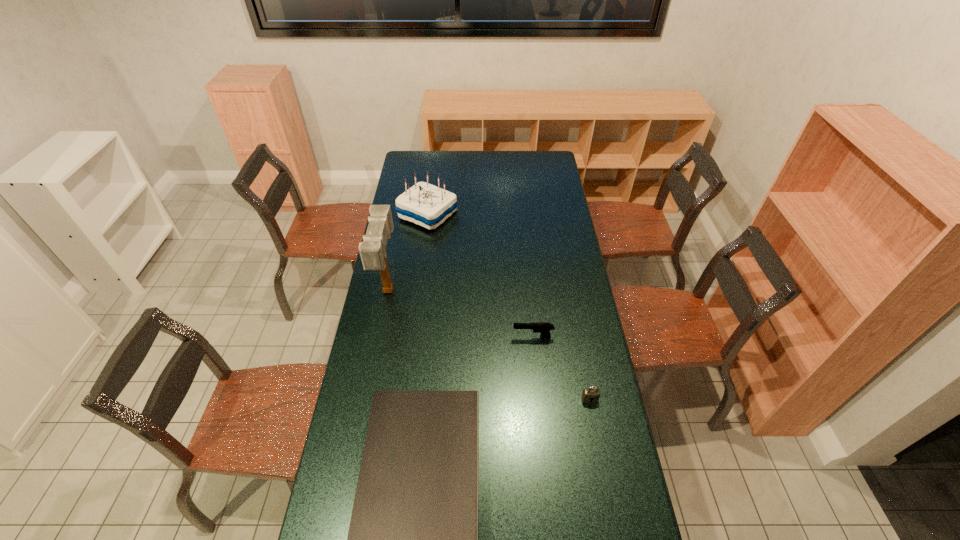
You are a GUI agent. You are given a task and a screenshot of the screen. Output one action in this format:
    pyautogui.click(x=<x>, y=<y>)
    Task: Click on the free space at the far left corner of the desktop
    The width and height of the screenshot is (960, 540).
    Given the screenshot: What is the action you would take?
    pyautogui.click(x=421, y=170)

Image resolution: width=960 pixels, height=540 pixels. I want to click on vacant space at the far right corner, so click(556, 170).

Identify the location of blank region between the pistol and the birthday cake. This screenshot has height=540, width=960. (480, 276).

Locate an element on the screen. vacant point located between the birthday cake and the second object from right to left is located at coordinates (480, 276).

This screenshot has height=540, width=960. Identify the location of free spot between the farthest object and the fourth farthest object. (509, 307).

At what (x,y) coordinates should I click in order to perform the action: click on free space that is in between the farthest object and the third nearest object. Please return your answer as a coordinate pair (x, y). The width and height of the screenshot is (960, 540). Looking at the image, I should click on (480, 276).

This screenshot has height=540, width=960. Identify the location of blank region between the padlock and the farthest object. (509, 307).

The width and height of the screenshot is (960, 540). I want to click on free space between the third farthest object and the birthday cake, so click(x=480, y=276).

Locate an element on the screen. This screenshot has width=960, height=540. object that is the fourth closest one to the rightmost object is located at coordinates (424, 204).

You are a GUI agent. You are given a task and a screenshot of the screen. Output one action in this format:
    pyautogui.click(x=<x>, y=<y>)
    Task: Click on the second closest object relative to the second farthest object
    
    Given the screenshot: What is the action you would take?
    pyautogui.click(x=413, y=536)